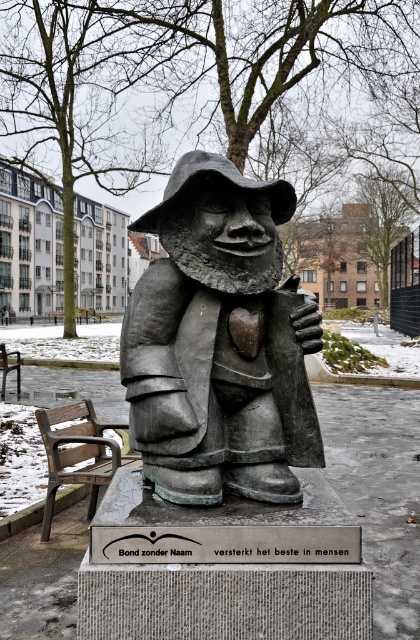
Can you confirm if bronze statue at center is positioned to the right of wooden park bench at lower left?

Yes, bronze statue at center is to the right of wooden park bench at lower left.

Is point (141, 332) less distant than point (15, 355)?

That is True.

Find the location of `bronze statue at center`. bronze statue at center is located at coordinates (220, 342).

Where is `bronze statue at center`? bronze statue at center is located at coordinates (220, 342).

Is point (252, 304) behind point (110, 442)?

That is False.

Is bronze statue at center thinner than wooden bench at lower left?

No, bronze statue at center is not thinner than wooden bench at lower left.

Describe the element at coordinates (220, 342) in the screenshot. The width and height of the screenshot is (420, 640). I see `bronze statue at center` at that location.

The image size is (420, 640). I want to click on bronze statue at center, so click(220, 342).

Does wooden bench at lower left have a greater height compared to wooden park bench at lower left?

Yes, wooden bench at lower left is taller than wooden park bench at lower left.

What do you see at coordinates (76, 452) in the screenshot? Image resolution: width=420 pixels, height=640 pixels. I see `wooden bench at lower left` at bounding box center [76, 452].

This screenshot has width=420, height=640. What do you see at coordinates (76, 452) in the screenshot?
I see `wooden bench at lower left` at bounding box center [76, 452].

You are a GUI agent. You are given a task and a screenshot of the screen. Output one action in this format:
    pyautogui.click(x=<x>, y=<y>)
    Task: Click on the wooden bench at lower left
    The image size is (420, 640).
    Given the screenshot: What is the action you would take?
    pyautogui.click(x=76, y=452)